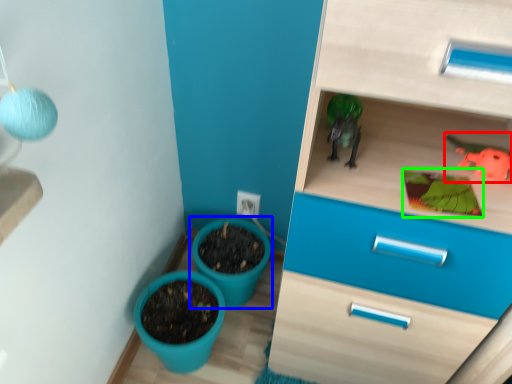
Question: Estimate the real-world distances between objects in this image. Which object is closer to toy (highlighted by a red box), flowerpot (highlighted by a blue box) or plant (highlighted by a green box)?

Choices:
 (A) flowerpot
 (B) plant

Answer: (B)